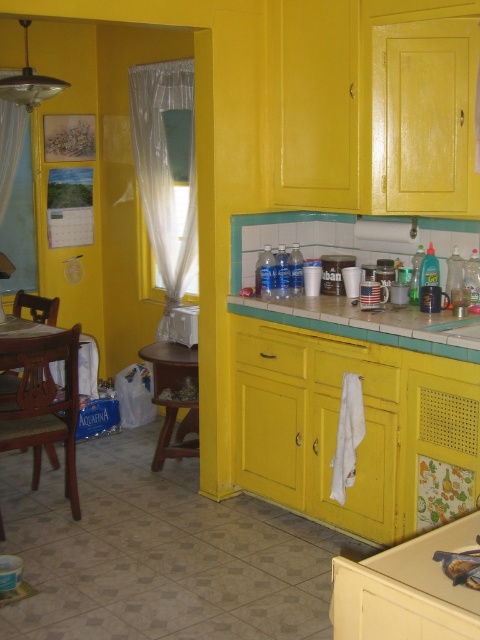
Question: Which point is closer to the camera?

Choices:
 (A) green tile countertop at center
 (B) transparent plastic curtain at left

Answer: (A)

Question: Which point appears closest to the camera in this image?

Choices:
 (A) (159, 280)
 (B) (478, 356)

Answer: (B)

Question: Does transparent plastic curtain at left have a larger size compared to green tile countertop at center?

Choices:
 (A) no
 (B) yes

Answer: (B)

Question: Which of the following is the closest to the observer?

Choices:
 (A) (189, 122)
 (B) (274, 296)

Answer: (B)

Question: From the image, what is the correct spatial relationship of transparent plastic curtain at left in relation to green tile countertop at center?

Choices:
 (A) right
 (B) left

Answer: (B)

Question: Is the position of transparent plastic curtain at left less distant than that of green tile countertop at center?

Choices:
 (A) no
 (B) yes

Answer: (A)